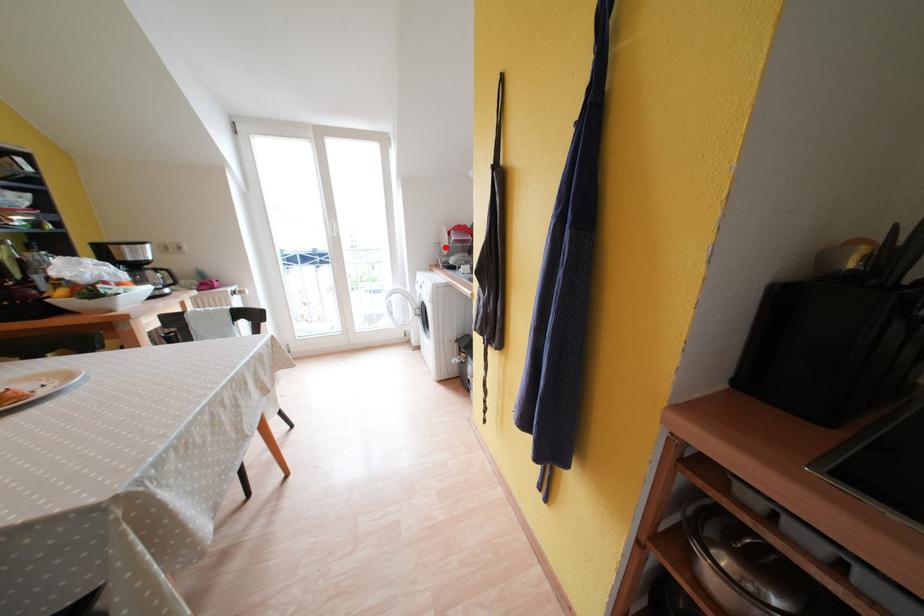
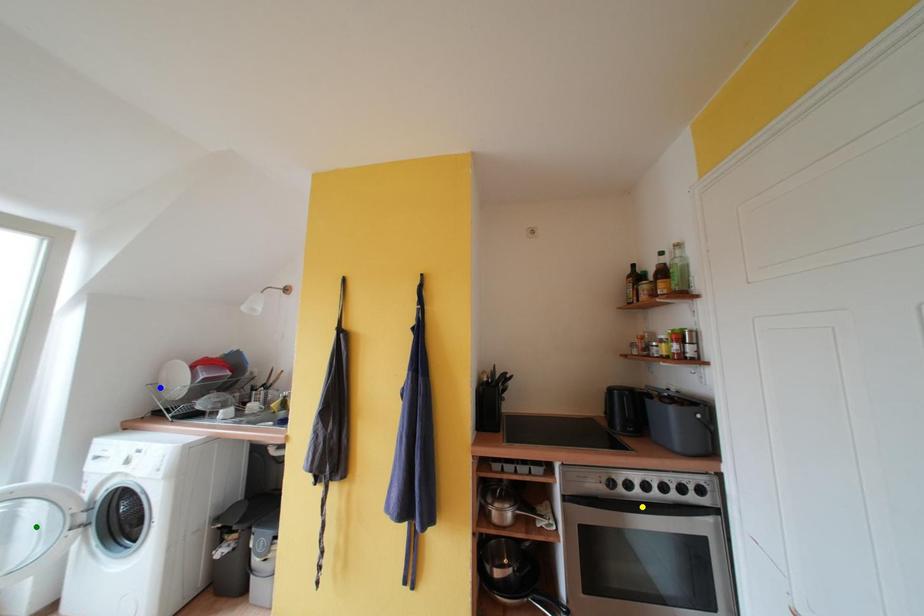
Question: I am providing you with two images of the same scene from different viewpoints. A red point is marked on the first image. You are given multiple points on the second image. Which point in image 2 is actually the same real-world point as the red point in image 1?

Choices:
 (A) yellow point
 (B) green point
 (C) blue point

Answer: (C)